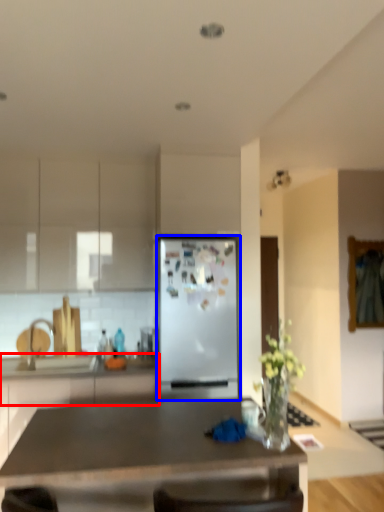
Question: Which of the following is the farthest to the observer, counter top (highlighted by a red box) or refrigerator (highlighted by a blue box)?

Choices:
 (A) counter top
 (B) refrigerator

Answer: (B)